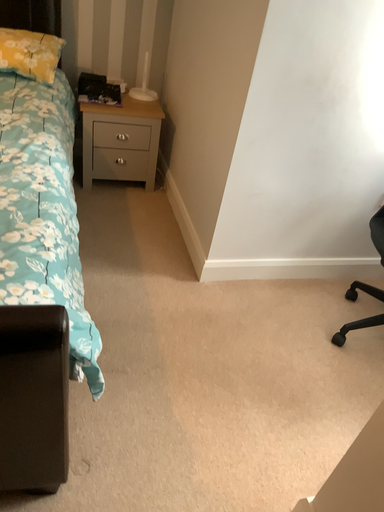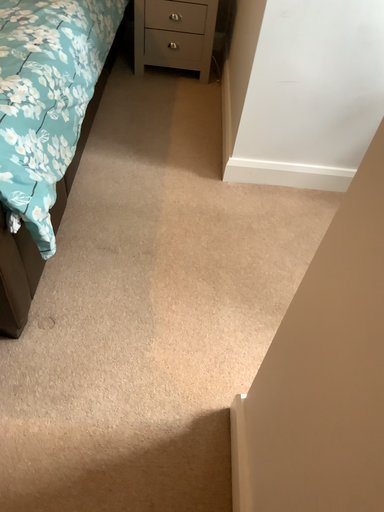
Question: How did the camera likely rotate when shooting the video?

Choices:
 (A) rotated downward
 (B) rotated upward

Answer: (A)